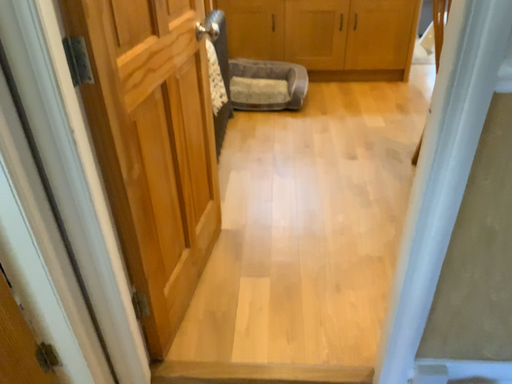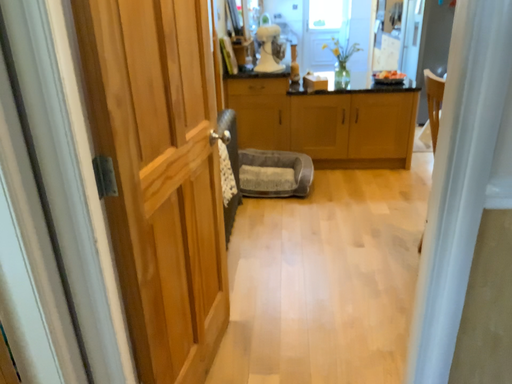
Question: How did the camera likely rotate when shooting the video?

Choices:
 (A) rotated upward
 (B) rotated downward

Answer: (A)